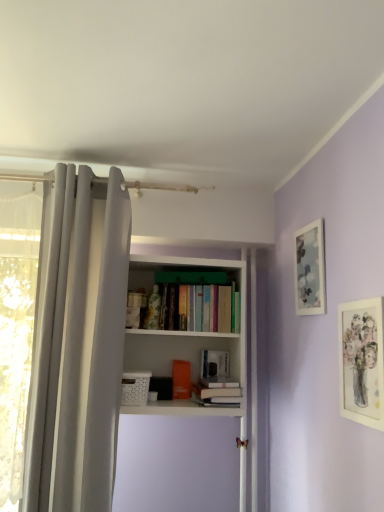
What do you see at coordinates (214, 366) in the screenshot? This screenshot has width=384, height=512. I see `white matte book at center, the second book positioned from the front` at bounding box center [214, 366].

The width and height of the screenshot is (384, 512). In order to click on white matte picture frame at upper right, which is counted as the first picture frame, starting from the front in this screenshot , I will do `click(361, 361)`.

In order to click on matte glass picture frame at upper right, the first picture frame when ordered from back to front in this screenshot , I will do `click(310, 269)`.

Locate an element on the screen. This screenshot has height=512, width=384. white fabric curtain at left is located at coordinates (78, 342).

Is white fabric curtain at left oriented away from matte glass picture frame at upper right, the first picture frame when ordered from back to front?

No, white fabric curtain at left is not facing away from matte glass picture frame at upper right, the first picture frame when ordered from back to front.

Are white fabric curtain at left and matte glass picture frame at upper right, arranged as the second picture frame when viewed from the front, making contact?

white fabric curtain at left and matte glass picture frame at upper right, arranged as the second picture frame when viewed from the front, are clearly separated.

In terms of size, does white fabric curtain at left appear bigger or smaller than matte glass picture frame at upper right, arranged as the second picture frame when viewed from the front?

Clearly, white fabric curtain at left is larger in size than matte glass picture frame at upper right, arranged as the second picture frame when viewed from the front.

From a real-world perspective, which object stands above the other?

From a 3D spatial view, matte glass picture frame at upper right, the first picture frame when ordered from back to front, is above.

In the scene shown: Is hardcover book at center, which appears as the second book when viewed from the back, in front of white matte bookshelf at center?

No, the depth of hardcover book at center, which appears as the second book when viewed from the back, is greater than that of white matte bookshelf at center.

Is hardcover book at center, which appears as the second book when viewed from the back, taller or shorter than white matte bookshelf at center?

In the image, hardcover book at center, which appears as the second book when viewed from the back, appears to be shorter than white matte bookshelf at center.

Between hardcover book at center, which appears as the second book when viewed from the back, and white matte bookshelf at center, which one has larger width?

white matte bookshelf at center is wider.

Could you tell me if hardcover book at center, the first book viewed from the front, is turned towards white matte bookshelf at center?

Yes, hardcover book at center, the first book viewed from the front, is facing white matte bookshelf at center.

Which object is closer to the camera taking this photo, white fabric curtain at left or white matte book at center, the second book positioned from the front?

white fabric curtain at left is closer to the camera.

Looking at this image, is white fabric curtain at left taller than white matte book at center, the first book viewed from the back?

Correct, white fabric curtain at left is much taller as white matte book at center, the first book viewed from the back.

Is white fabric curtain at left oriented away from white matte book at center, the first book viewed from the back?

No, white fabric curtain at left's orientation is not away from white matte book at center, the first book viewed from the back.

Can you confirm if white matte book at center, the first book viewed from the back, is positioned to the right of white matte picture frame at upper right, the second picture frame positioned from the back?

No, white matte book at center, the first book viewed from the back, is not to the right of white matte picture frame at upper right, the second picture frame positioned from the back.

Is white matte book at center, the first book viewed from the back, positioned before white matte picture frame at upper right, the second picture frame positioned from the back?

No, it is behind white matte picture frame at upper right, the second picture frame positioned from the back.

From the image's perspective, is white matte book at center, the second book positioned from the front, located above or below white matte picture frame at upper right, which is counted as the first picture frame, starting from the front?

white matte book at center, the second book positioned from the front, is below white matte picture frame at upper right, which is counted as the first picture frame, starting from the front.

From the picture: Is white matte book at center, the second book positioned from the front, directly adjacent to white matte picture frame at upper right, which is counted as the first picture frame, starting from the front?

No, white matte book at center, the second book positioned from the front, is not with white matte picture frame at upper right, which is counted as the first picture frame, starting from the front.

From the image's perspective, is white fabric curtain at left over hardcover book at center, the first book viewed from the front?

Correct, white fabric curtain at left appears higher than hardcover book at center, the first book viewed from the front, in the image.

Is point (74, 175) closer to viewer compared to point (229, 396)?

No, (74, 175) is behind (229, 396).

Is white fabric curtain at left situated inside hardcover book at center, which appears as the second book when viewed from the back, or outside?

white fabric curtain at left is outside hardcover book at center, which appears as the second book when viewed from the back.

From a real-world perspective, who is located lower, white matte book at center, the first book viewed from the back, or matte glass picture frame at upper right, the first picture frame when ordered from back to front?

In real-world perspective, white matte book at center, the first book viewed from the back, is lower.

Considering the relative sizes of white matte book at center, the first book viewed from the back, and matte glass picture frame at upper right, the first picture frame when ordered from back to front, in the image provided, is white matte book at center, the first book viewed from the back, taller than matte glass picture frame at upper right, the first picture frame when ordered from back to front,?

No.

Considering the points (204, 375) and (312, 226), which point is behind, point (204, 375) or point (312, 226)?

The point (204, 375) is farther from the camera.

Between white matte book at center, the first book viewed from the back, and matte glass picture frame at upper right, the first picture frame when ordered from back to front, which one has smaller size?

matte glass picture frame at upper right, the first picture frame when ordered from back to front, is smaller.

Is white matte bookshelf at center placed right next to hardcover book at center, which appears as the second book when viewed from the back?

They are not placed beside each other.

In the scene shown: Is hardcover book at center, the first book viewed from the front, a part of white matte bookshelf at center?

Yes, white matte bookshelf at center is surrounding hardcover book at center, the first book viewed from the front.

Does point (199, 477) lie in front of point (218, 388)?

No.

Is white matte bookshelf at center shorter than hardcover book at center, the first book viewed from the front?

In fact, white matte bookshelf at center may be taller than hardcover book at center, the first book viewed from the front.

In the image, there is a matte glass picture frame at upper right, the first picture frame when ordered from back to front. Identify the location of curtain below it (from the image's perspective). The image size is (384, 512). (78, 342).

Find the location of `shelf located above the hardcover book at center, which appears as the second book when viewed from the back (from the image's perspective)`. shelf located above the hardcover book at center, which appears as the second book when viewed from the back (from the image's perspective) is located at coordinates (186, 409).

Considering their positions, is white matte book at center, the second book positioned from the front, positioned closer to white fabric curtain at left than hardcover book at center, the first book viewed from the front?

The object closer to white fabric curtain at left is hardcover book at center, the first book viewed from the front.

When comparing their distances from hardcover book at center, which appears as the second book when viewed from the back, does white matte picture frame at upper right, the second picture frame positioned from the back, or matte glass picture frame at upper right, arranged as the second picture frame when viewed from the front, seem further?

Among the two, white matte picture frame at upper right, the second picture frame positioned from the back, is located further to hardcover book at center, which appears as the second book when viewed from the back.

From the image, which object appears to be farther from matte glass picture frame at upper right, arranged as the second picture frame when viewed from the front, white fabric curtain at left or hardcover book at center, which appears as the second book when viewed from the back?

Among the two, white fabric curtain at left is located further to matte glass picture frame at upper right, arranged as the second picture frame when viewed from the front.

Considering their positions, is white matte book at center, the second book positioned from the front, positioned further to matte glass picture frame at upper right, arranged as the second picture frame when viewed from the front, than white matte picture frame at upper right, which is counted as the first picture frame, starting from the front?

white matte book at center, the second book positioned from the front, is positioned further to the anchor matte glass picture frame at upper right, arranged as the second picture frame when viewed from the front.

Which object lies further to the anchor point white matte book at center, the second book positioned from the front, white fabric curtain at left or white matte picture frame at upper right, which is counted as the first picture frame, starting from the front?

white matte picture frame at upper right, which is counted as the first picture frame, starting from the front, lies further to white matte book at center, the second book positioned from the front, than the other object.

Based on the photo, looking at the image, which one is located closer to matte glass picture frame at upper right, arranged as the second picture frame when viewed from the front, white fabric curtain at left or white matte bookshelf at center?

white matte bookshelf at center lies closer to matte glass picture frame at upper right, arranged as the second picture frame when viewed from the front, than the other object.

When comparing their distances from white fabric curtain at left, does matte glass picture frame at upper right, the first picture frame when ordered from back to front, or white matte book at center, the second book positioned from the front, seem closer?

white matte book at center, the second book positioned from the front, is positioned closer to the anchor white fabric curtain at left.

From the image, which object appears to be farther from white matte picture frame at upper right, the second picture frame positioned from the back, matte glass picture frame at upper right, the first picture frame when ordered from back to front, or white fabric curtain at left?

Among the two, white fabric curtain at left is located further to white matte picture frame at upper right, the second picture frame positioned from the back.

Locate an element on the screen. book between white matte bookshelf at center and white matte book at center, the second book positioned from the front, along the z-axis is located at coordinates (214, 392).

Where is `shelf between white matte picture frame at upper right, which is counted as the first picture frame, starting from the front, and white matte book at center, the first book viewed from the back, from front to back`? shelf between white matte picture frame at upper right, which is counted as the first picture frame, starting from the front, and white matte book at center, the first book viewed from the back, from front to back is located at coordinates (186, 409).

The height and width of the screenshot is (512, 384). Identify the location of book situated between white fabric curtain at left and white matte book at center, the second book positioned from the front, from left to right. (214, 392).

The width and height of the screenshot is (384, 512). Find the location of `picture frame located between white fabric curtain at left and white matte picture frame at upper right, the second picture frame positioned from the back, in the left-right direction`. picture frame located between white fabric curtain at left and white matte picture frame at upper right, the second picture frame positioned from the back, in the left-right direction is located at coordinates (310, 269).